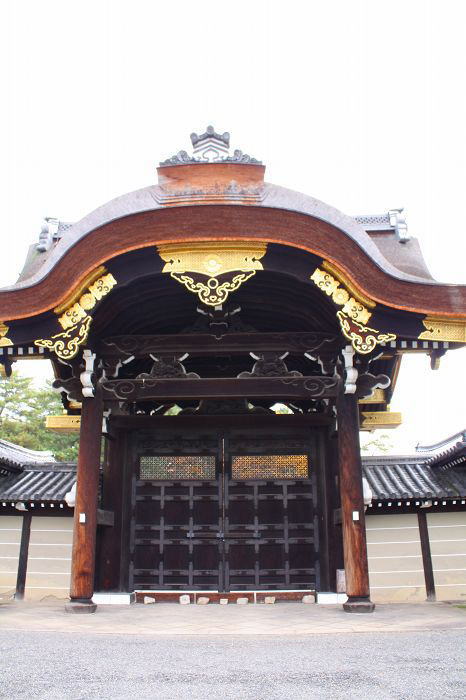
Find the location of `door`. door is located at coordinates (191, 514), (269, 500).